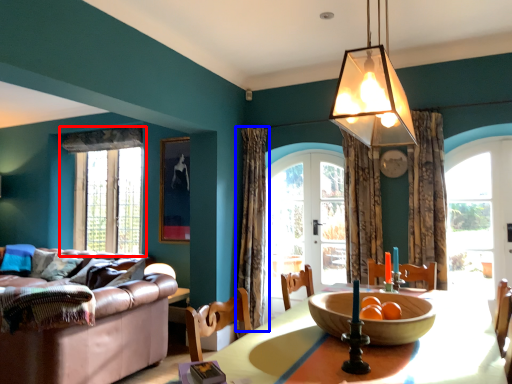
Question: Among these objects, which one is farthest to the camera, window (highlighted by a red box) or curtain (highlighted by a blue box)?

Choices:
 (A) window
 (B) curtain

Answer: (A)